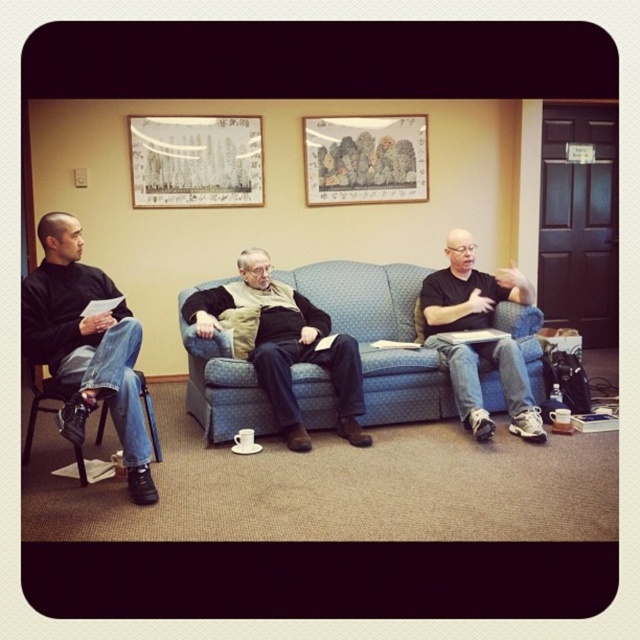
What is located at the coordinates point [476,342]?

The black matte shirt at center is located at point [476,342].

You are standing in the room and want to hand a document to the person wearing the black matte shirt at center. To your left, there is a matte paper picture frame at upper left. In which direction should you move to reach the person?

The black matte shirt at center is to the right of the matte paper picture frame at upper left, so you should move to the right to reach the person wearing the black matte shirt at center.